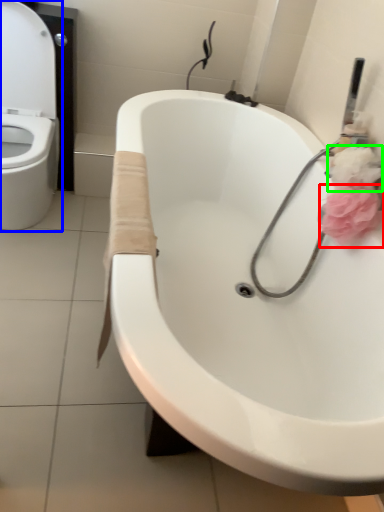
Question: Estimate the real-world distances between objects in this image. Which object is closer to flower (highlighted by a red box), toilet (highlighted by a blue box) or flower (highlighted by a green box)?

Choices:
 (A) toilet
 (B) flower

Answer: (B)